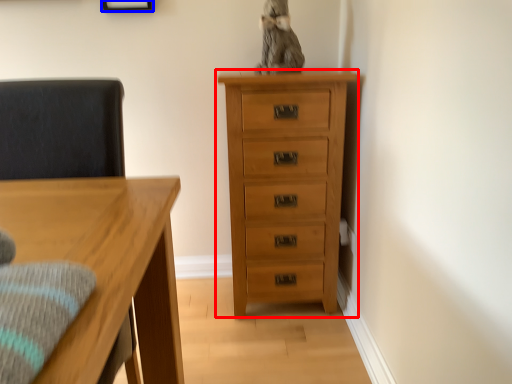
Question: Which point is further to the camera, chest of drawers (highlighted by a red box) or picture frame (highlighted by a blue box)?

Choices:
 (A) chest of drawers
 (B) picture frame

Answer: (B)